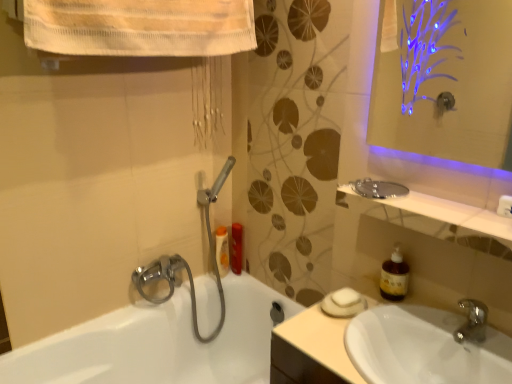
Where is `blank space above clear glass mirror at upper right (from a real-world perspective)`? This screenshot has width=512, height=384. blank space above clear glass mirror at upper right (from a real-world perspective) is located at coordinates (449, 211).